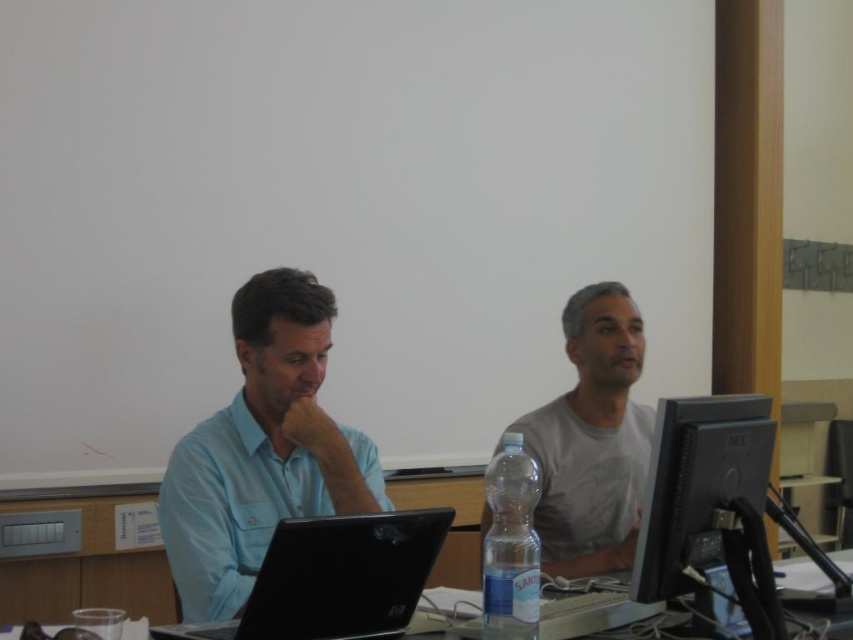
Is clear plastic bottle at center positioned at the back of black plastic table at center?

No, it is in front of black plastic table at center.

Does clear plastic bottle at center have a lesser height compared to black plastic table at center?

No, clear plastic bottle at center is not shorter than black plastic table at center.

Who is more forward, (494, 460) or (112, 595)?

Positioned in front is point (494, 460).

This screenshot has height=640, width=853. In order to click on clear plastic bottle at center in this screenshot , I will do `click(509, 545)`.

Is point (769, 460) in front of point (15, 566)?

Yes, point (769, 460) is in front of point (15, 566).

Between point (664, 506) and point (9, 621), which one is positioned in front?

Point (664, 506) is more forward.

Identify the location of matte black monitor at right. The image size is (853, 640). (699, 484).

Does light blue shirt at center appear under gray cotton shirt at center?

Correct, light blue shirt at center is located below gray cotton shirt at center.

The image size is (853, 640). What do you see at coordinates (262, 451) in the screenshot? I see `light blue shirt at center` at bounding box center [262, 451].

Which is in front, point (294, 429) or point (546, 451)?

Point (294, 429)

I want to click on light blue shirt at center, so click(262, 451).